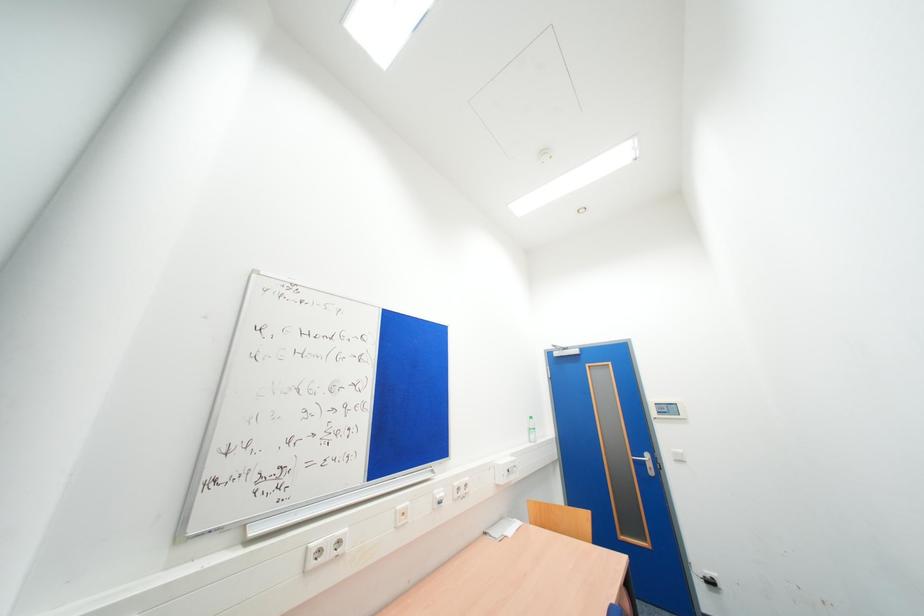
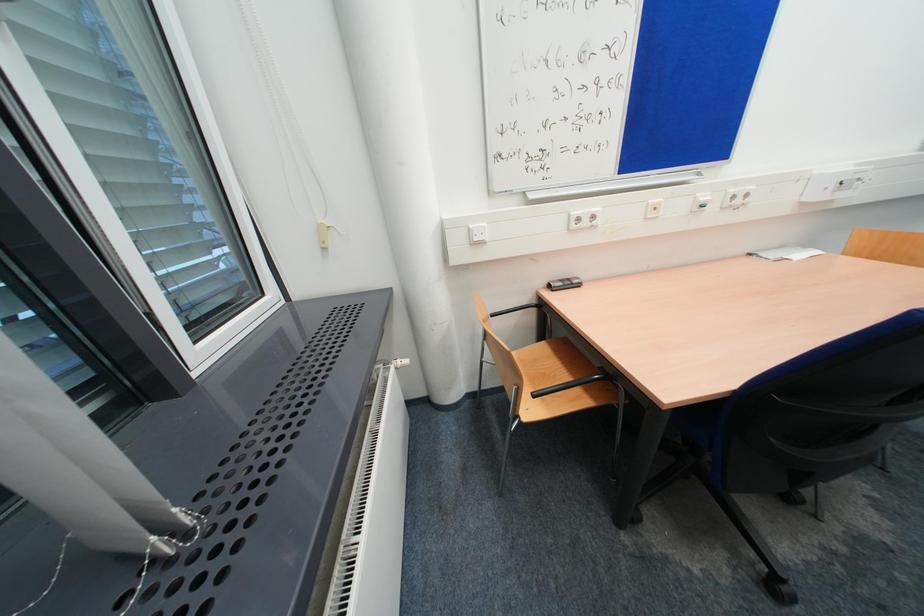
First-person continuous shooting, in which direction is the camera rotating?

The camera rotated toward left-down.